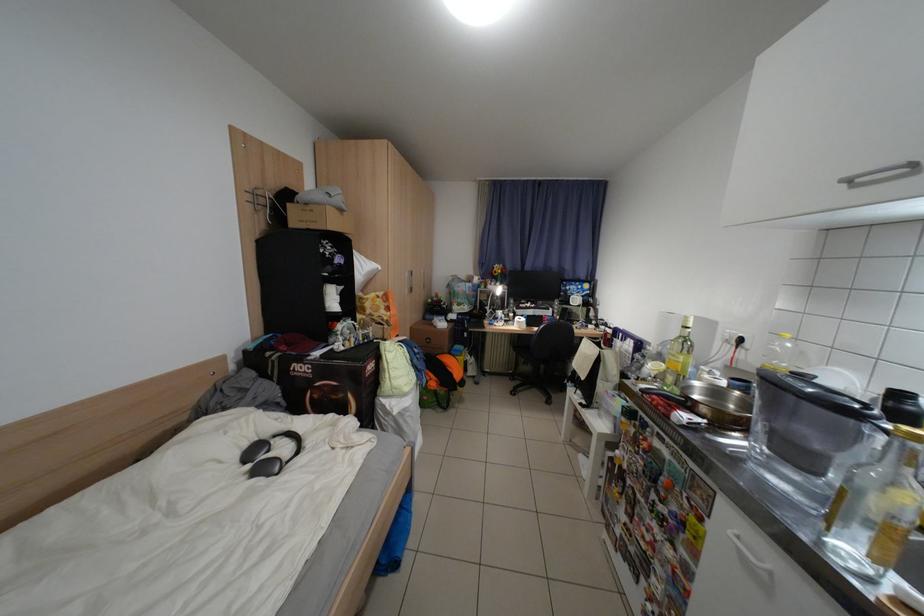
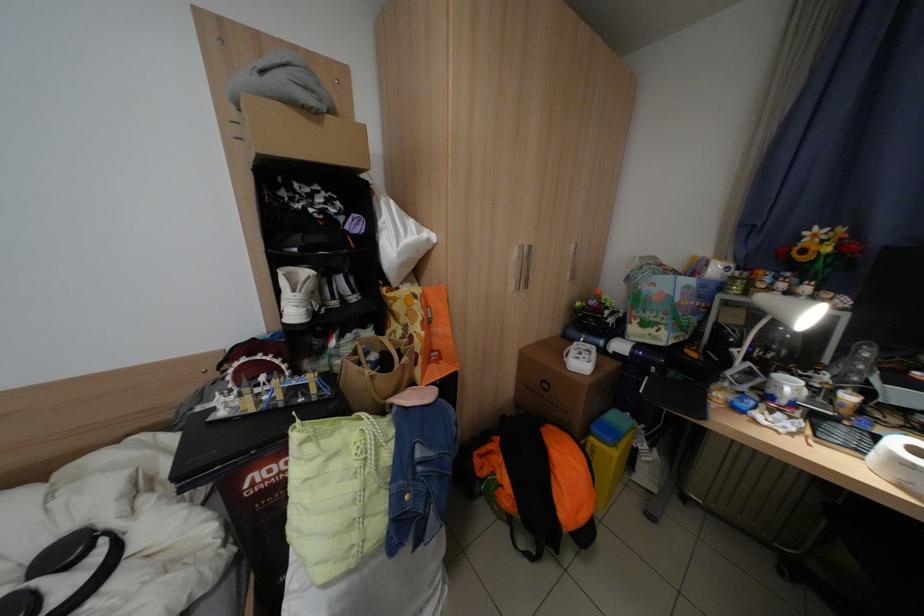
In the second image, find the point that corresponds to the point at 419,292 in the first image.

(524, 286)